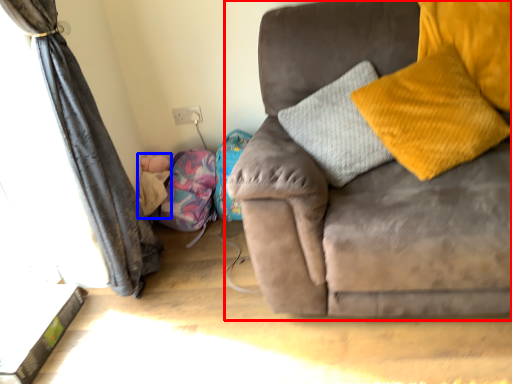
Question: Among these objects, which one is farthest to the camera, studio couch (highlighted by a red box) or baby (highlighted by a blue box)?

Choices:
 (A) studio couch
 (B) baby

Answer: (B)